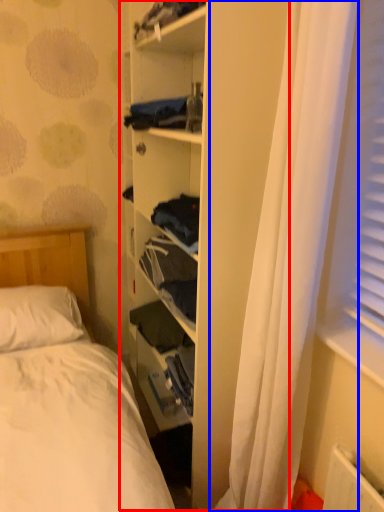
Question: Which point is closer to the camera, bookshelf (highlighted by a red box) or curtain (highlighted by a blue box)?

Choices:
 (A) bookshelf
 (B) curtain

Answer: (B)